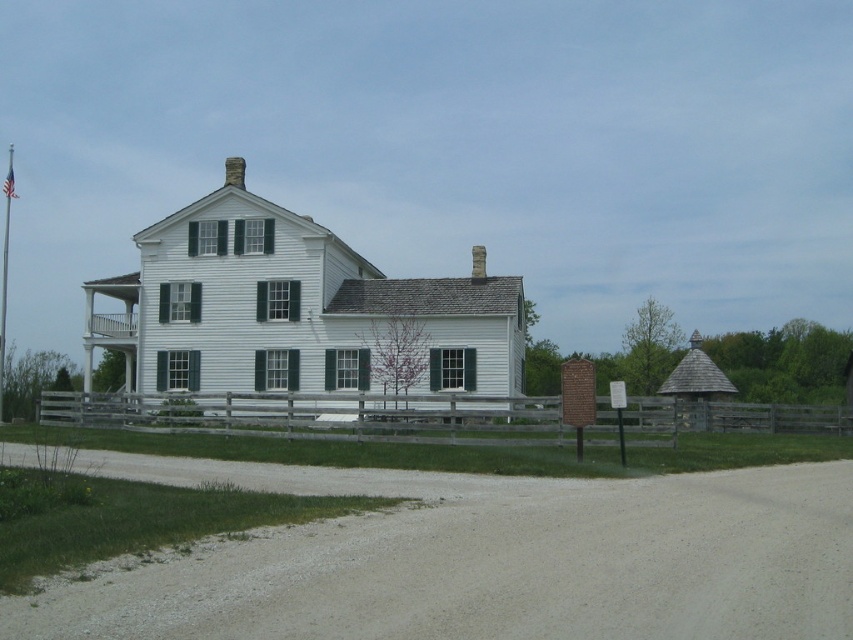
In the scene shown: You are a delivery person approaching the house and see the gray gravel dirt track at lower center and the wooden at center. Which path should you take to reach the house?

You should take the gray gravel dirt track at lower center because it is to the left of the wooden at center and leads up to the house.